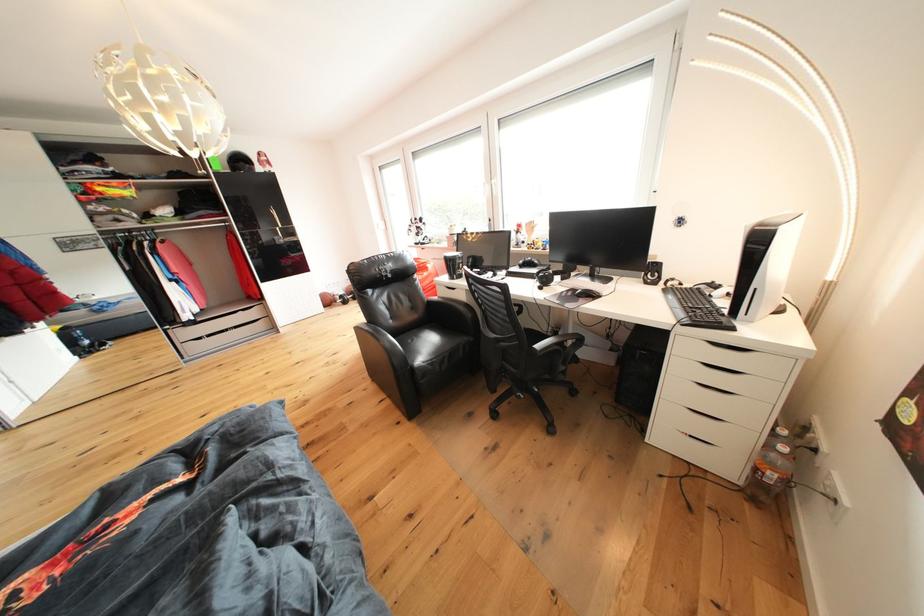
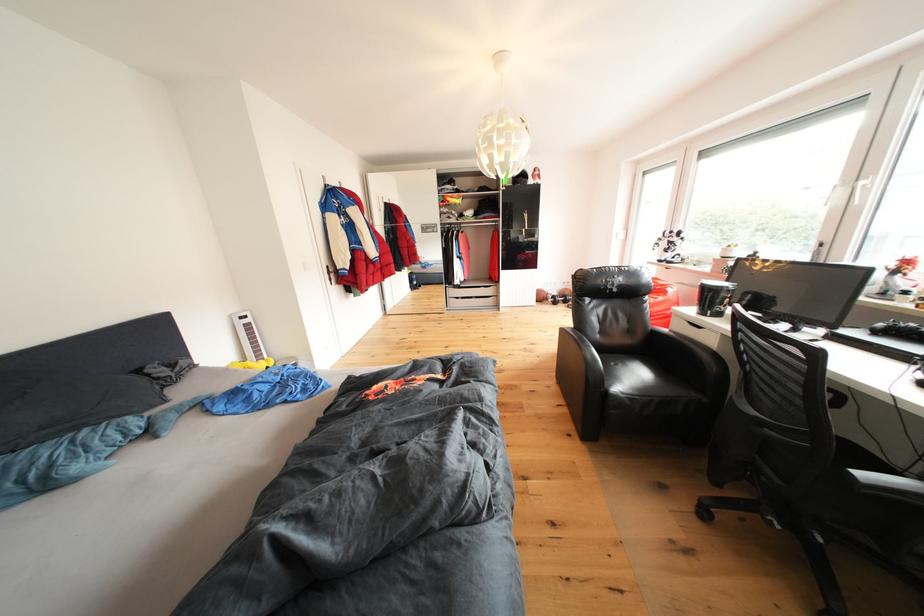
Where in the second image is the point corresponding to pixel 367 334 from the first image?

(572, 334)